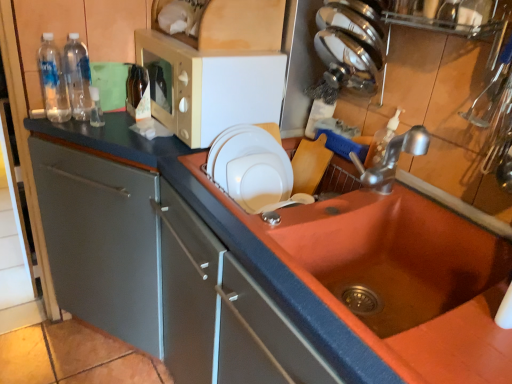
Question: Is white glossy plate at upper center, which appears as the 1th appliance when ordered from the bottom, oriented towards brown glass bottle at upper left, acting as the 1th bottle starting from the right?

Choices:
 (A) yes
 (B) no

Answer: (B)

Question: Would you say white glossy plate at upper center, the first appliance viewed from the left, is outside brown glass bottle at upper left, acting as the 1th bottle starting from the right?

Choices:
 (A) yes
 (B) no

Answer: (A)

Question: Can you confirm if white glossy plate at upper center, the 2th appliance viewed from the right, is smaller than brown glass bottle at upper left, which is the third bottle from left to right?

Choices:
 (A) yes
 (B) no

Answer: (B)

Question: Is white glossy plate at upper center, which appears as the 2th appliance when viewed from the top, positioned with its back to brown glass bottle at upper left, acting as the 1th bottle starting from the right?

Choices:
 (A) yes
 (B) no

Answer: (A)

Question: Can you confirm if white glossy plate at upper center, the first appliance viewed from the left, is positioned to the right of brown glass bottle at upper left, acting as the 1th bottle starting from the right?

Choices:
 (A) no
 (B) yes

Answer: (B)

Question: From a real-world perspective, relative to clear plastic bottles at left, the third bottle viewed from the right, is white glossy plate at upper center, the 2th appliance viewed from the right, vertically above or below?

Choices:
 (A) below
 (B) above

Answer: (A)

Question: Is point (209, 158) positioned closer to the camera than point (42, 33)?

Choices:
 (A) closer
 (B) farther

Answer: (A)

Question: Considering the positions of white glossy plate at upper center, which appears as the 1th appliance when ordered from the bottom, and clear plastic bottles at left, placed as the first bottle when sorted from left to right, in the image, is white glossy plate at upper center, which appears as the 1th appliance when ordered from the bottom, wider or thinner than clear plastic bottles at left, placed as the first bottle when sorted from left to right,?

Choices:
 (A) wide
 (B) thin

Answer: (B)

Question: Is white glossy plate at upper center, the first appliance viewed from the left, taller or shorter than clear plastic bottles at left, placed as the first bottle when sorted from left to right?

Choices:
 (A) short
 (B) tall

Answer: (A)

Question: Is matte gray countertop at center in front of or behind white glossy plate at upper center, the first appliance viewed from the left, in the image?

Choices:
 (A) behind
 (B) front

Answer: (B)

Question: In the image, is matte gray countertop at center on the left side or the right side of white glossy plate at upper center, which appears as the 1th appliance when ordered from the bottom?

Choices:
 (A) right
 (B) left

Answer: (B)

Question: Considering the positions of matte gray countertop at center and white glossy plate at upper center, which appears as the 1th appliance when ordered from the bottom, in the image, is matte gray countertop at center taller or shorter than white glossy plate at upper center, which appears as the 1th appliance when ordered from the bottom,?

Choices:
 (A) tall
 (B) short

Answer: (A)

Question: Looking at the image, does matte gray countertop at center seem bigger or smaller compared to white glossy plate at upper center, the first appliance viewed from the left?

Choices:
 (A) big
 (B) small

Answer: (A)

Question: Relative to polished stainless steel knives at upper right, the second appliance viewed from the left, is beige plastic microwave at upper center in front or behind?

Choices:
 (A) front
 (B) behind

Answer: (B)

Question: In terms of height, does beige plastic microwave at upper center look taller or shorter compared to polished stainless steel knives at upper right, the second appliance viewed from the left?

Choices:
 (A) short
 (B) tall

Answer: (B)